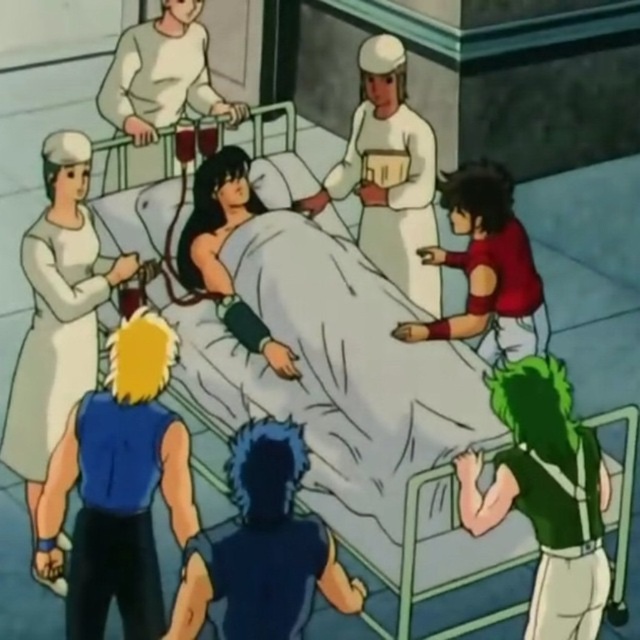
Who is taller, green fabric shirt at right or red matte shirt at right?

green fabric shirt at right

Measure the distance between green fabric shirt at right and camera.

They are 5.09 meters apart.

Is point (576, 440) farther from camera compared to point (456, 260)?

No, (576, 440) is closer to viewer.

The width and height of the screenshot is (640, 640). In order to click on green fabric shirt at right in this screenshot , I will do coord(547,493).

Is green fabric shirt at right positioned behind white matte nurse at upper left?

No, it is in front of white matte nurse at upper left.

Is point (596, 584) positioned after point (129, 51)?

No, (596, 584) is closer to viewer.

Who is more distant from viewer, (544, 436) or (145, 131)?

The point (145, 131) is more distant.

This screenshot has width=640, height=640. I want to click on green fabric shirt at right, so click(x=547, y=493).

Does dark blue fabric shirt at center appear on the right side of white matte nurse at upper left?

Indeed, dark blue fabric shirt at center is positioned on the right side of white matte nurse at upper left.

Describe the element at coordinates (262, 547) in the screenshot. The width and height of the screenshot is (640, 640). I see `dark blue fabric shirt at center` at that location.

Where is `dark blue fabric shirt at center`? dark blue fabric shirt at center is located at coordinates (262, 547).